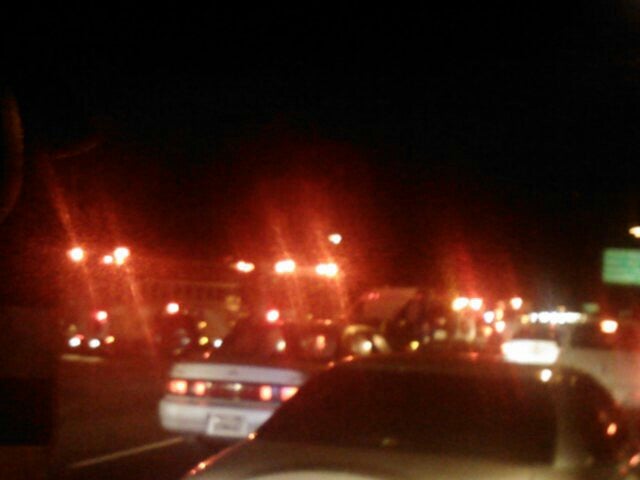
The width and height of the screenshot is (640, 480). What are the coordinates of `lights` in the screenshot? It's located at (253, 270).